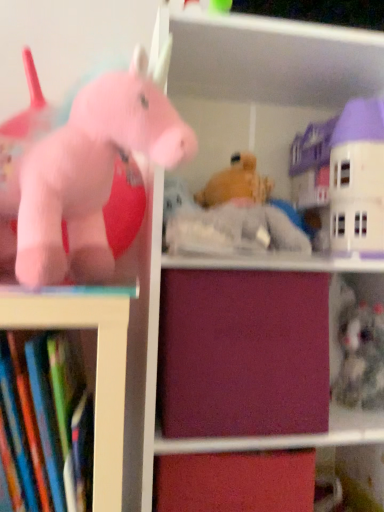
Question: From the image's perspective, would you say fuzzy gray stuffed animal at lower right, which ranks as the 3th toy in front-to-back order, is shown under pastel cream plastic house at upper right, the 2th toy in the right-to-left sequence?

Choices:
 (A) yes
 (B) no

Answer: (A)

Question: Does fuzzy gray stuffed animal at lower right, which ranks as the 3th toy in front-to-back order, have a greater height compared to pastel cream plastic house at upper right, marked as the 2th toy in a front-to-back arrangement?

Choices:
 (A) yes
 (B) no

Answer: (B)

Question: From a real-world perspective, does fuzzy gray stuffed animal at lower right, which is the 1th toy from right to left, stand above pastel cream plastic house at upper right, marked as the 2th toy in a front-to-back arrangement?

Choices:
 (A) no
 (B) yes

Answer: (A)

Question: Does fuzzy gray stuffed animal at lower right, acting as the 3th toy starting from the left, appear on the right side of pastel cream plastic house at upper right, the 2th toy in the right-to-left sequence?

Choices:
 (A) no
 (B) yes

Answer: (B)

Question: Is fuzzy gray stuffed animal at lower right, the first toy positioned from the back, to the left of pastel cream plastic house at upper right, the 2th toy positioned from the left, from the viewer's perspective?

Choices:
 (A) no
 (B) yes

Answer: (A)

Question: In terms of height, does burgundy matte drawer at center look taller or shorter compared to matte pink plush unicorn at left, which is the first toy in front-to-back order?

Choices:
 (A) short
 (B) tall

Answer: (A)

Question: Would you say burgundy matte drawer at center is to the left or to the right of matte pink plush unicorn at left, which is the first toy in front-to-back order, in the picture?

Choices:
 (A) right
 (B) left

Answer: (A)

Question: Does point (231, 357) appear closer or farther from the camera than point (74, 112)?

Choices:
 (A) farther
 (B) closer

Answer: (A)

Question: Is burgundy matte drawer at center spatially inside matte pink plush unicorn at left, which appears as the 3th toy when viewed from the right, or outside of it?

Choices:
 (A) inside
 (B) outside

Answer: (B)

Question: Considering the positions of point (357, 167) and point (158, 88), is point (357, 167) closer or farther from the camera than point (158, 88)?

Choices:
 (A) closer
 (B) farther

Answer: (B)

Question: From a real-world perspective, is pastel cream plastic house at upper right, the 2th toy positioned from the left, physically located above or below matte pink plush unicorn at left, which is the first toy in front-to-back order?

Choices:
 (A) below
 (B) above

Answer: (B)

Question: In terms of size, does pastel cream plastic house at upper right, the 2th toy positioned from the left, appear bigger or smaller than matte pink plush unicorn at left, which ranks as the 1th toy in left-to-right order?

Choices:
 (A) big
 (B) small

Answer: (B)

Question: Looking at their shapes, would you say pastel cream plastic house at upper right, the second toy from the back, is wider or thinner than matte pink plush unicorn at left, which ranks as the 1th toy in left-to-right order?

Choices:
 (A) wide
 (B) thin

Answer: (A)

Question: Is burgundy matte drawer at center wider or thinner than hardcover books at left?

Choices:
 (A) thin
 (B) wide

Answer: (B)

Question: Relative to hardcover books at left, is burgundy matte drawer at center in front or behind?

Choices:
 (A) behind
 (B) front

Answer: (A)